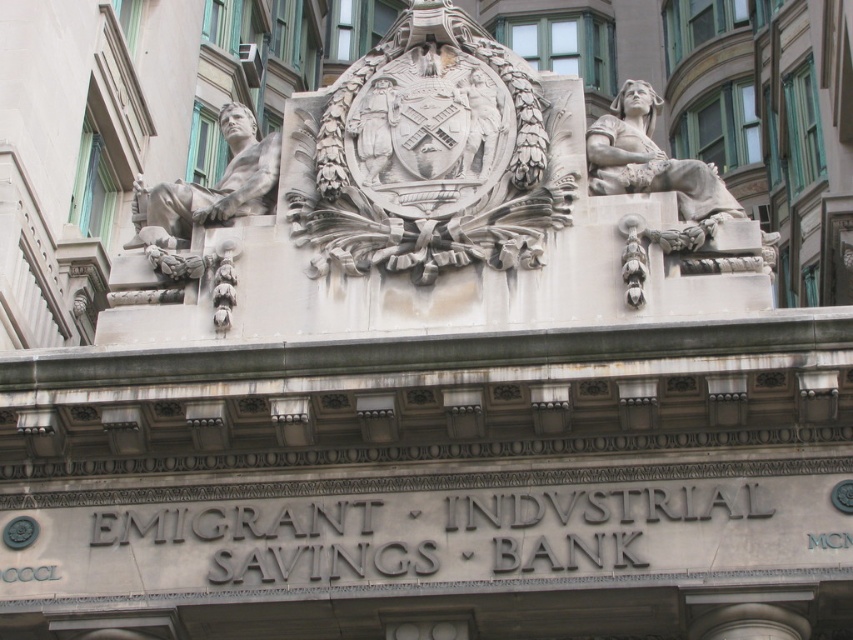
You are an architect examining the building facade. You notice two points marked on the image at coordinates point (194,220) and point (625,88). If you were to draw a straight line between them, would the line pass closer to the entrance of the building or the top of the building?

The line between point (194,220) and point (625,88) would pass closer to the entrance of the building because point (194,220) is in front of point (625,88).

You are an architect examining the building facade. You need to determine which statue, the matte gray stone statue at left or the white stone statue at upper right, has a larger width. Based on the architectural details provided, which one is wider?

The white stone statue at upper right is wider than the matte gray stone statue at left.